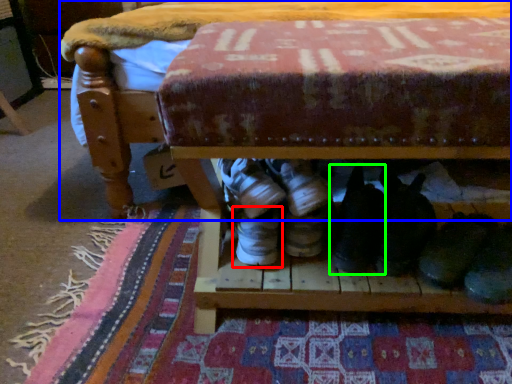
Question: Considering the real-world distances, which object is farthest from footwear (highlighted by a red box)? furniture (highlighted by a blue box) or footwear (highlighted by a green box)?

Choices:
 (A) furniture
 (B) footwear

Answer: (A)